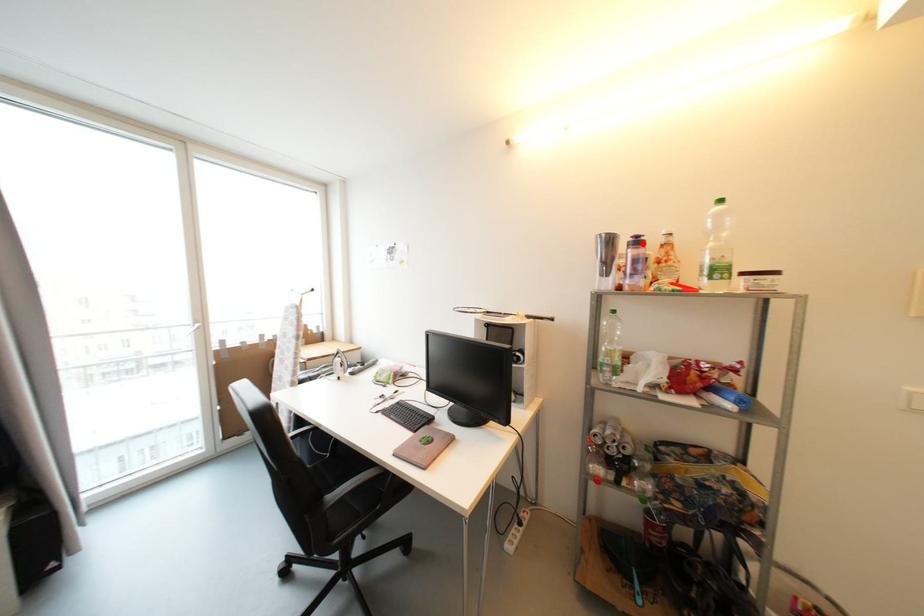
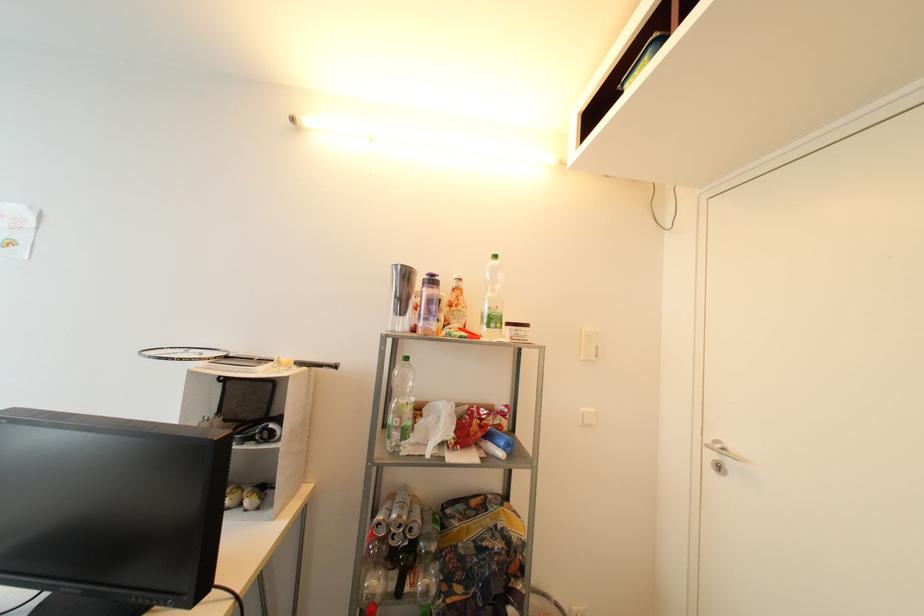
Find the pixel in the second image that matches the highlighted location in the first image.

(438, 283)